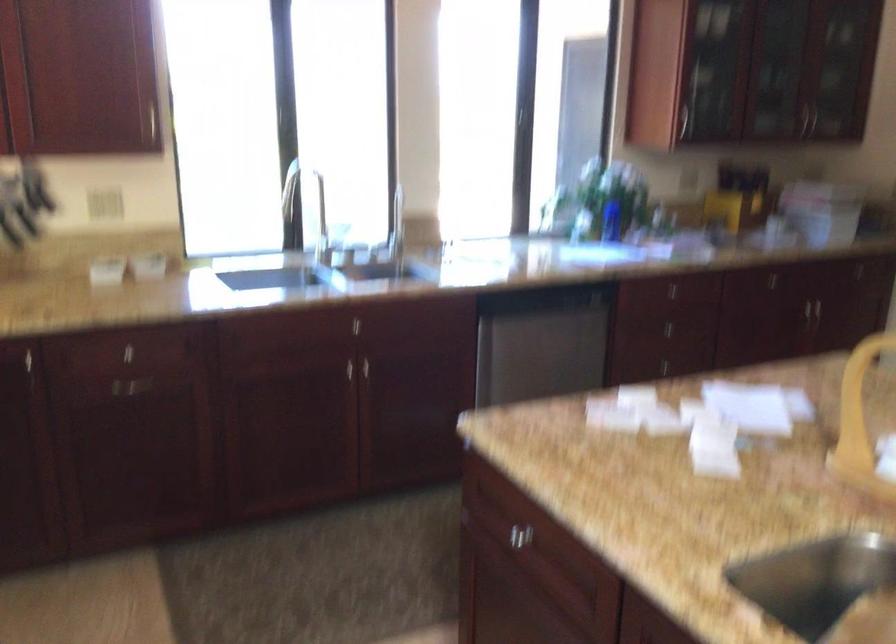
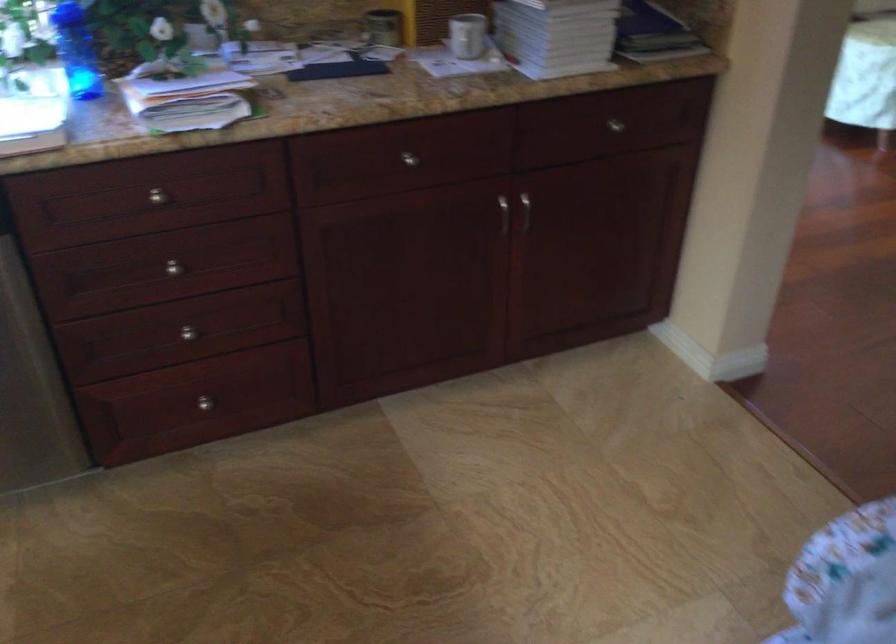
The point at (692, 359) is marked in the first image. Where is the corresponding point in the second image?

(188, 333)